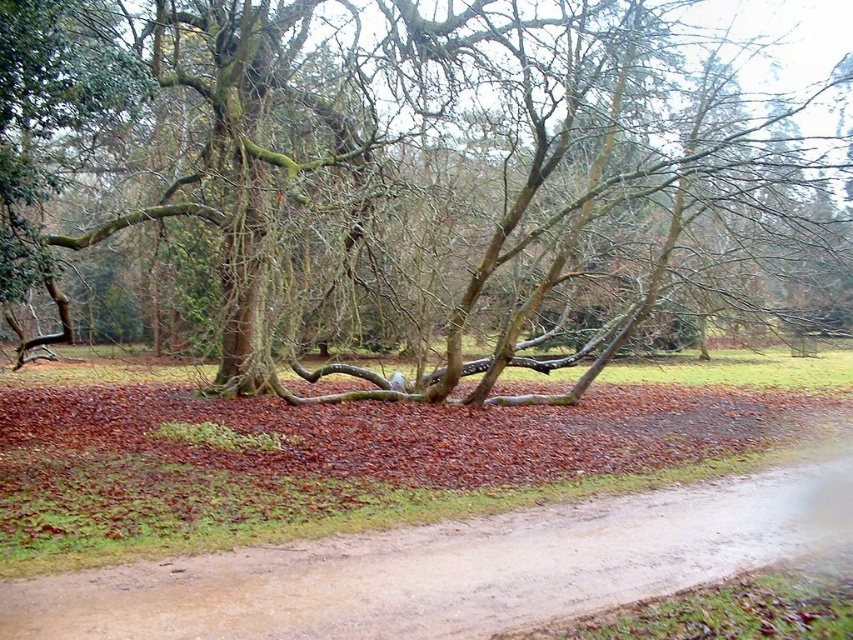
Question: Which of the following is the closest to the observer?

Choices:
 (A) dirt road at center
 (B) green mossy tree trunk at center

Answer: (A)

Question: Does green mossy tree trunk at center appear under dirt road at center?

Choices:
 (A) yes
 (B) no

Answer: (B)

Question: Can you confirm if green mossy tree trunk at center is thinner than dirt road at center?

Choices:
 (A) yes
 (B) no

Answer: (B)

Question: Is green mossy tree trunk at center bigger than dirt road at center?

Choices:
 (A) yes
 (B) no

Answer: (A)

Question: Which object is farther from the camera taking this photo?

Choices:
 (A) dirt road at center
 (B) green mossy tree trunk at center

Answer: (B)